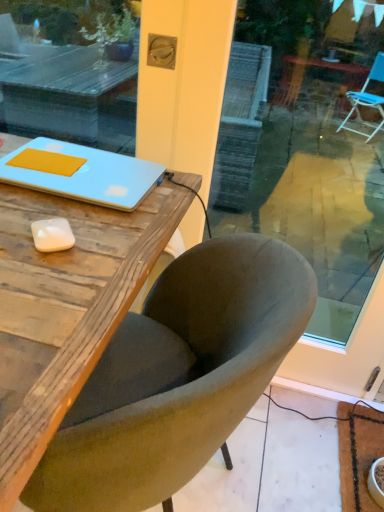
What do you see at coordinates (80, 173) in the screenshot? I see `matte blue laptop at upper left` at bounding box center [80, 173].

Measure the distance between point [110,201] and camera.

A distance of 79.20 centimeters exists between point [110,201] and camera.

Image resolution: width=384 pixels, height=512 pixels. Identify the location of matte blue laptop at upper left. (80, 173).

Where is `velvet green chair at center`? The width and height of the screenshot is (384, 512). velvet green chair at center is located at coordinates (184, 383).

Describe the element at coordinates (184, 383) in the screenshot. The width and height of the screenshot is (384, 512). I see `velvet green chair at center` at that location.

Locate an element on the screen. matte blue laptop at upper left is located at coordinates (80, 173).

Considering the positions of objects velvet green chair at center and matte blue laptop at upper left in the image provided, who is more to the right, velvet green chair at center or matte blue laptop at upper left?

velvet green chair at center.

Which is behind, velvet green chair at center or matte blue laptop at upper left?

matte blue laptop at upper left is further from the camera.

Between point (84, 489) and point (29, 157), which one is positioned behind?

Positioned behind is point (29, 157).

From the image's perspective, does velvet green chair at center appear higher than matte blue laptop at upper left?

Actually, velvet green chair at center appears below matte blue laptop at upper left in the image.

From a real-world perspective, is velvet green chair at center on top of matte blue laptop at upper left?

Incorrect, from a real-world perspective, velvet green chair at center is lower than matte blue laptop at upper left.

Which of these two, velvet green chair at center or matte blue laptop at upper left, is thinner?

matte blue laptop at upper left is thinner.

Considering the relative sizes of velvet green chair at center and matte blue laptop at upper left in the image provided, is velvet green chair at center shorter than matte blue laptop at upper left?

No.

From the picture: Considering the sizes of velvet green chair at center and matte blue laptop at upper left in the image, is velvet green chair at center bigger or smaller than matte blue laptop at upper left?

Clearly, velvet green chair at center is larger in size than matte blue laptop at upper left.

Can we say velvet green chair at center lies outside matte blue laptop at upper left?

Indeed, velvet green chair at center is completely outside matte blue laptop at upper left.

Would you say velvet green chair at center is a long distance from matte blue laptop at upper left?

That's not correct — velvet green chair at center is a little close to matte blue laptop at upper left.

Is velvet green chair at center oriented towards matte blue laptop at upper left?

Yes, velvet green chair at center faces towards matte blue laptop at upper left.

Can you tell me how much velvet green chair at center and matte blue laptop at upper left differ in facing direction?

The angle between the facing direction of velvet green chair at center and the facing direction of matte blue laptop at upper left is 90 degrees.

How much distance is there between velvet green chair at center and matte blue laptop at upper left?

The distance of velvet green chair at center from matte blue laptop at upper left is 13.05 inches.

The width and height of the screenshot is (384, 512). What are the coordinates of `laptop above the velvet green chair at center (from a real-world perspective)` in the screenshot? It's located at [x=80, y=173].

From the picture: Which is more to the left, matte blue laptop at upper left or velvet green chair at center?

From the viewer's perspective, matte blue laptop at upper left appears more on the left side.

Based on the photo, is matte blue laptop at upper left in front of velvet green chair at center?

No, matte blue laptop at upper left is further to the viewer.

Is point (110, 185) closer to camera compared to point (258, 320)?

No.

From the image's perspective, which object appears higher, matte blue laptop at upper left or velvet green chair at center?

matte blue laptop at upper left appears higher in the image.

From a real-world perspective, relative to velvet green chair at center, is matte blue laptop at upper left vertically above or below?

In terms of real-world spatial position, matte blue laptop at upper left is above velvet green chair at center.

Is matte blue laptop at upper left wider than velvet green chair at center?

No, matte blue laptop at upper left is not wider than velvet green chair at center.

Is matte blue laptop at upper left taller or shorter than velvet green chair at center?

Considering their sizes, matte blue laptop at upper left has less height than velvet green chair at center.

Who is smaller, matte blue laptop at upper left or velvet green chair at center?

matte blue laptop at upper left.

Would you say matte blue laptop at upper left contains velvet green chair at center?

No, matte blue laptop at upper left does not contain velvet green chair at center.

Is matte blue laptop at upper left placed right next to velvet green chair at center?

No, matte blue laptop at upper left is not beside velvet green chair at center.

Could you tell me if matte blue laptop at upper left is turned towards velvet green chair at center?

Yes, matte blue laptop at upper left faces towards velvet green chair at center.

Measure the distance between matte blue laptop at upper left and velvet green chair at center.

13.05 inches.

Locate an element on the screen. chair on the right of matte blue laptop at upper left is located at coordinates (184, 383).

The height and width of the screenshot is (512, 384). Identify the location of laptop above the velvet green chair at center (from the image's perspective). (80, 173).

I want to click on chair below the matte blue laptop at upper left (from the image's perspective), so click(x=184, y=383).